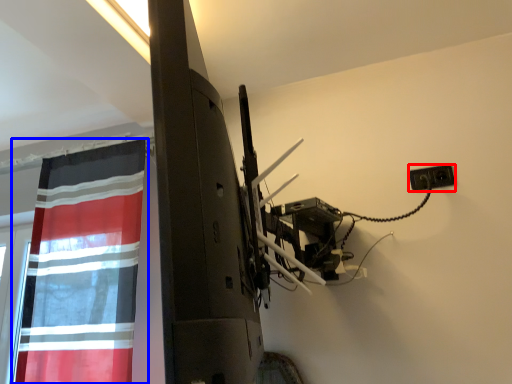
Question: Which object is closer to the camera taking this photo, electric outlet (highlighted by a red box) or curtain (highlighted by a blue box)?

Choices:
 (A) electric outlet
 (B) curtain

Answer: (B)